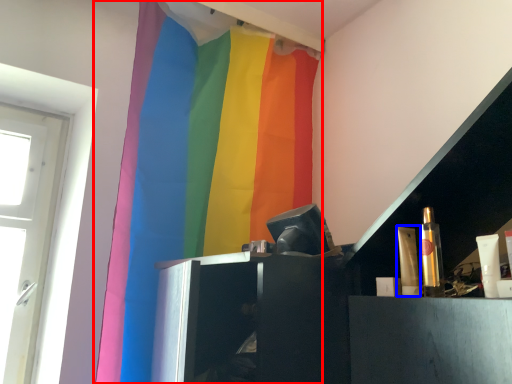
Question: Which object is closer to the camera taking this photo, curtain (highlighted by a red box) or toiletry (highlighted by a blue box)?

Choices:
 (A) curtain
 (B) toiletry

Answer: (B)